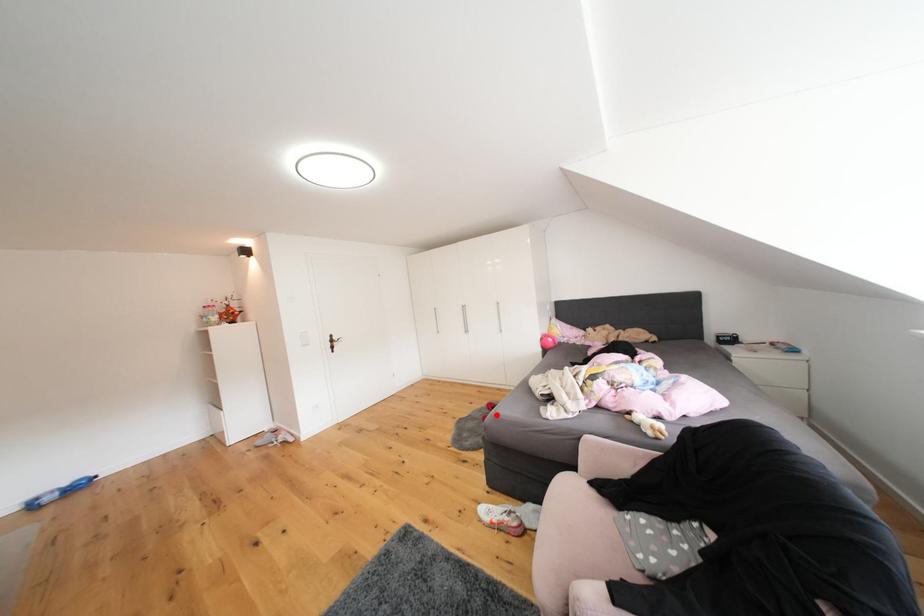
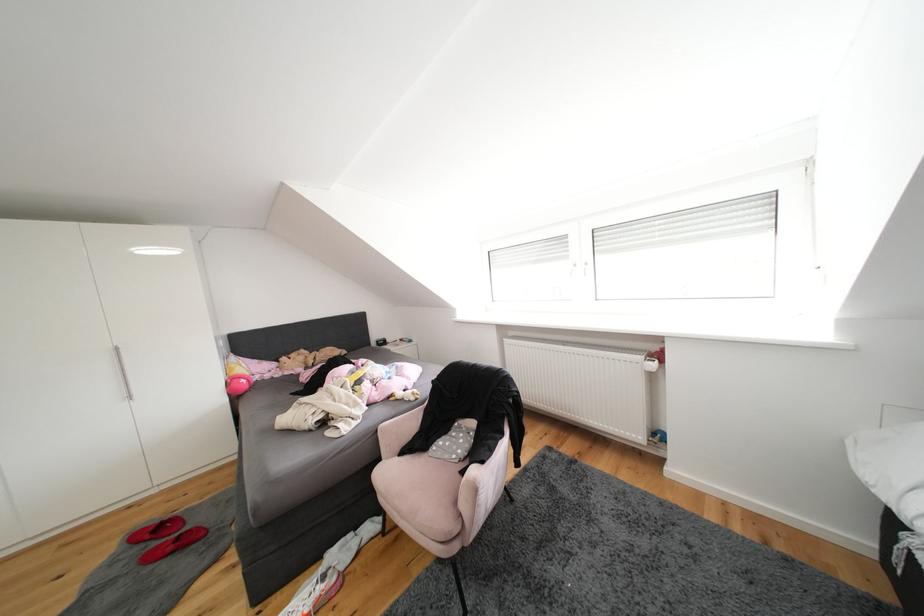
Locate, in the second image, the point that corresponds to the highlighted location in the first image.

(146, 553)